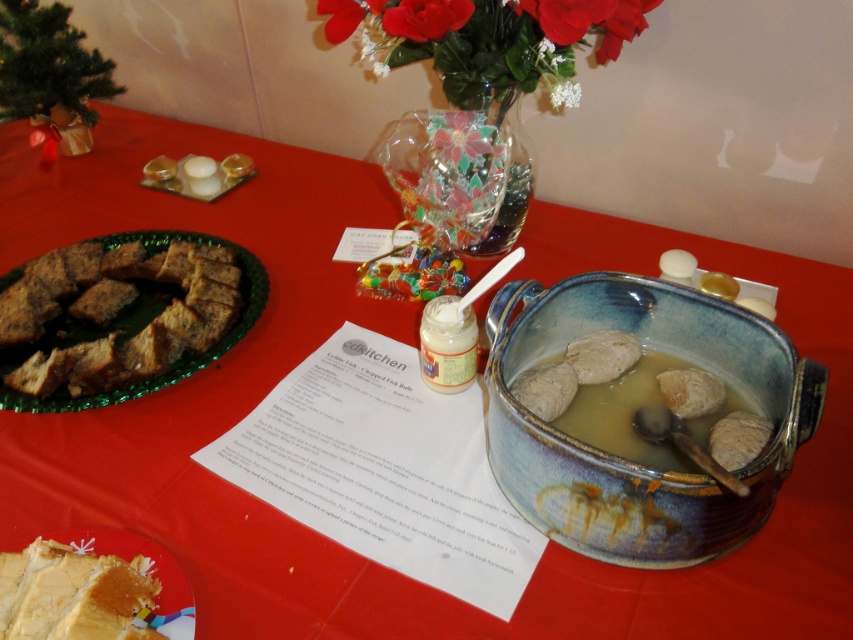
Question: Does red silk flowers at upper center come in front of brown crumbly bread at left?

Choices:
 (A) no
 (B) yes

Answer: (A)

Question: Which of the following is the farthest from the observer?

Choices:
 (A) yellow cake at center
 (B) white matte flower at upper center
 (C) red silk flowers at upper center
 (D) translucent glass vase at upper center

Answer: (D)

Question: Which of the following is the farthest from the observer?

Choices:
 (A) red silk flowers at upper center
 (B) brown crumbly bread at left

Answer: (A)

Question: Is yellow cake at center wider than translucent glass vase at upper center?

Choices:
 (A) no
 (B) yes

Answer: (B)

Question: Does yellow cake at center have a larger size compared to blue glazed pot at center?

Choices:
 (A) no
 (B) yes

Answer: (A)

Question: Which object is the farthest from the yellow cake at center?

Choices:
 (A) red silk flowers at upper center
 (B) brown crumbly bread at left
 (C) blue glazed pot at center

Answer: (A)